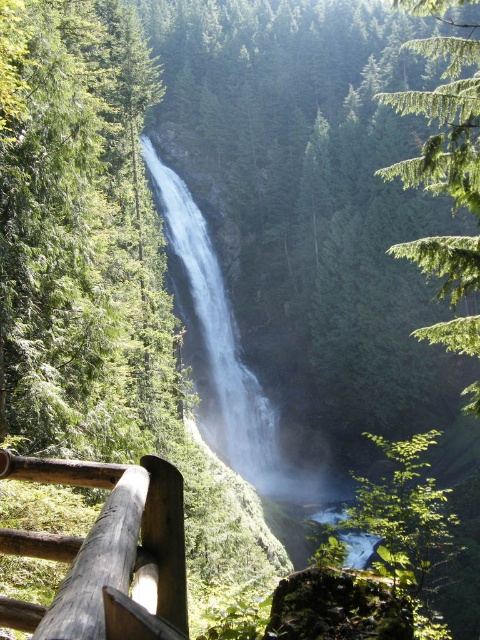
You are standing at the edge of the viewing platform and want to take a photo of the white smooth waterfall at center. However, you notice the dark brown wooden rail at lower left might block your view. Based on their positions, will the rail obstruct the waterfall in your photo?

The dark brown wooden rail at lower left is closer to the viewer than the white smooth waterfall at center, so it will likely obstruct the waterfall in your photo unless you move the camera position to avoid it.